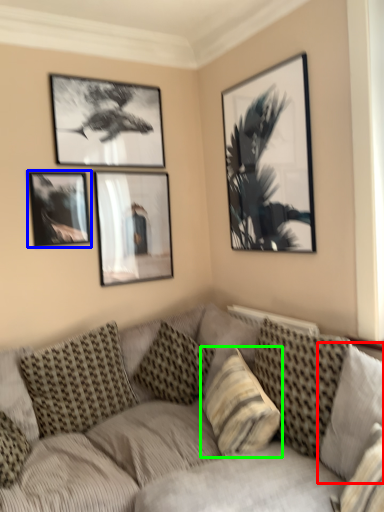
Question: Which object is the farthest from pillow (highlighted by a red box)? Choose among these: picture frame (highlighted by a blue box) or pillow (highlighted by a green box).

Choices:
 (A) picture frame
 (B) pillow

Answer: (A)